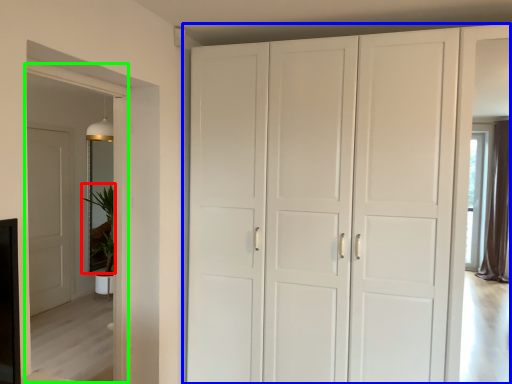
Question: Which object is positioned farthest from plant (highlighted by a red box)? Select from cupboard (highlighted by a blue box) and glass door (highlighted by a green box).

Choices:
 (A) cupboard
 (B) glass door

Answer: (A)